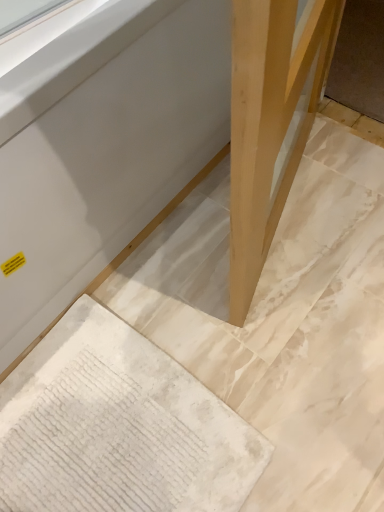
This screenshot has width=384, height=512. In order to click on vacant area that is situated to the right of natural wood leg at center in this screenshot , I will do `click(341, 193)`.